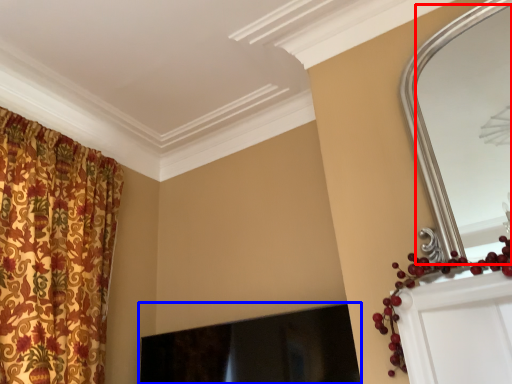
Question: Which object appears closest to the camera in this image, mirror (highlighted by a red box) or fireplace (highlighted by a blue box)?

Choices:
 (A) mirror
 (B) fireplace

Answer: (A)